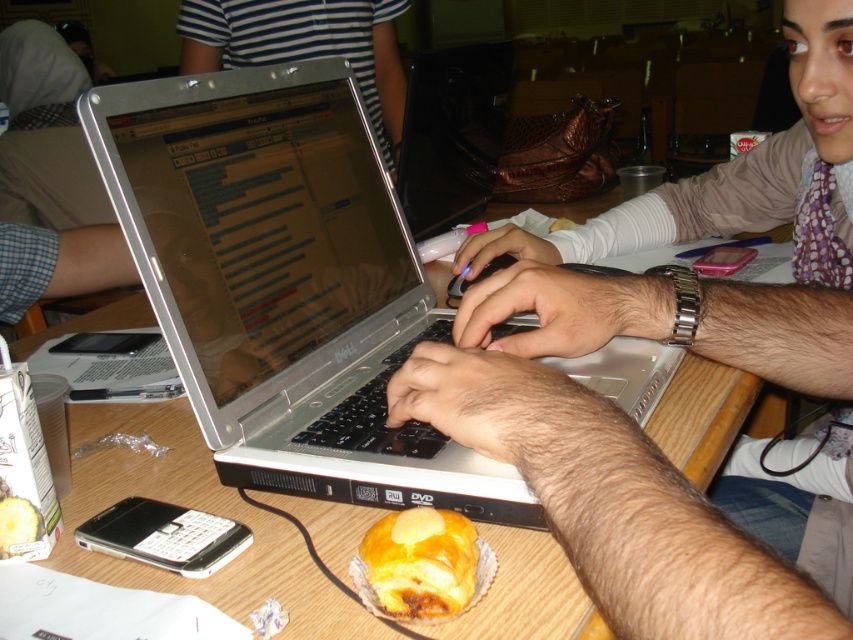
Question: Is metallic silver laptop at center smaller than striped fabric shirt at upper center?

Choices:
 (A) yes
 (B) no

Answer: (A)

Question: Among these points, which one is farthest from the camera?

Choices:
 (A) (635, 380)
 (B) (399, 3)
 (C) (380, 580)

Answer: (B)

Question: Among these points, which one is farthest from the camera?

Choices:
 (A) (444, 570)
 (B) (308, 28)
 (C) (827, 500)

Answer: (B)

Question: Does metallic silver laptop at center come behind silver metallic laptop at center?

Choices:
 (A) yes
 (B) no

Answer: (B)

Question: Is metallic silver laptop at center closer to the viewer compared to striped fabric shirt at upper center?

Choices:
 (A) yes
 (B) no

Answer: (A)

Question: Which point is closer to the camera taking this photo?

Choices:
 (A) (843, 584)
 (B) (297, 184)

Answer: (B)